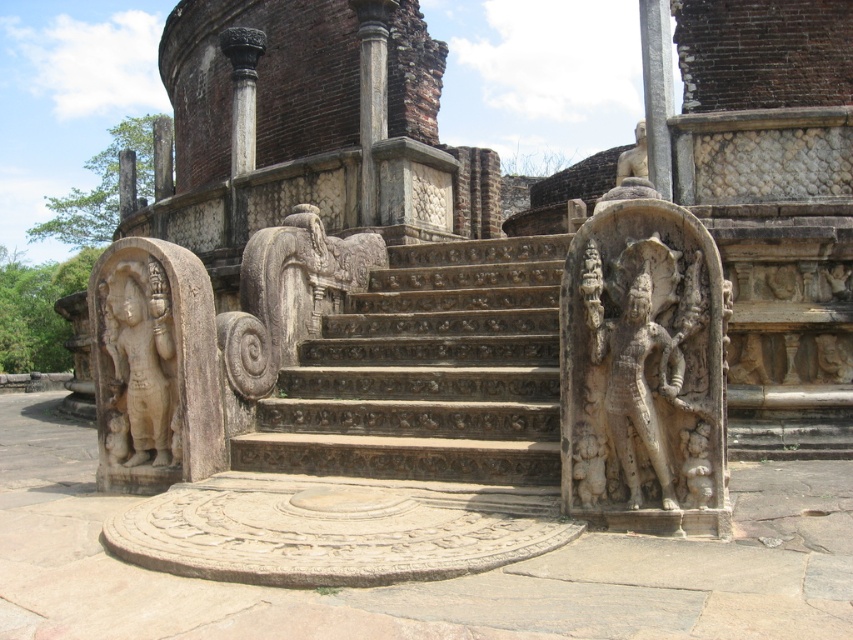
You are standing at the bottom of the steps leading to the circular platform. You want to place a small offering at the base of the stone statues at center and the beige stone statue at left. Which statue should you approach first to place your offering without having to backtrack?

You should approach the stone statues at center first because it is closer to the viewer than the beige stone statue at left, so you can place the offering there first before moving further to the beige stone statue at left without needing to backtrack.

You are an architect visiting this historical site. You notice the beige stone statue at left and the white stone statue at upper center. Which statue is shorter in height?

The beige stone statue at left is not as tall as the white stone statue at upper center, so the beige stone statue at left is shorter.

You are visiting an ancient temple and want to take a photo of the stone statues at center and the carved stone stairs at center. If you stand at the base of the stairs, will the statues block your view of the stairs?

The stone statues at center is in front of carved stone stairs at center, so standing at the base of the stairs would position the statues between you and the stairs. This means the statues will block your view of the carved stone stairs at center.